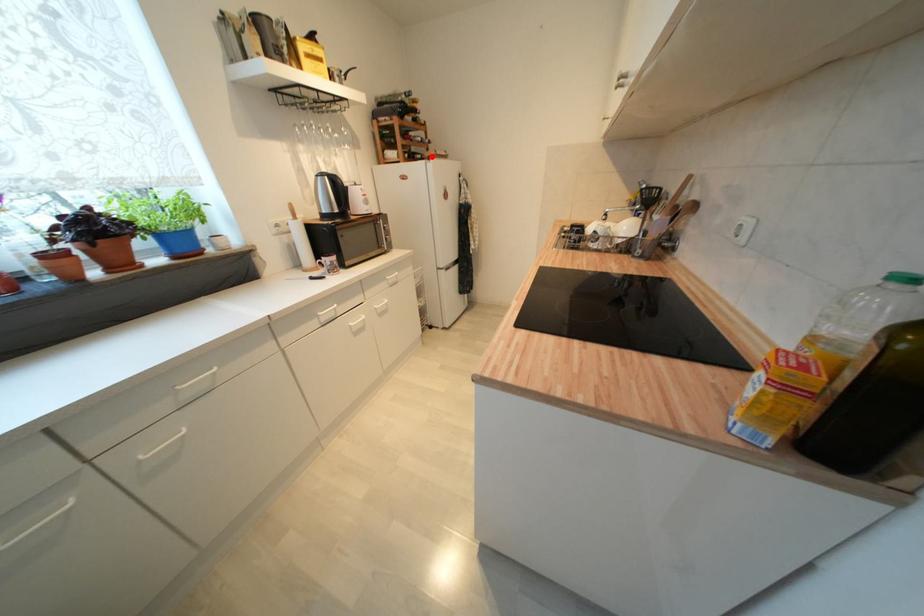
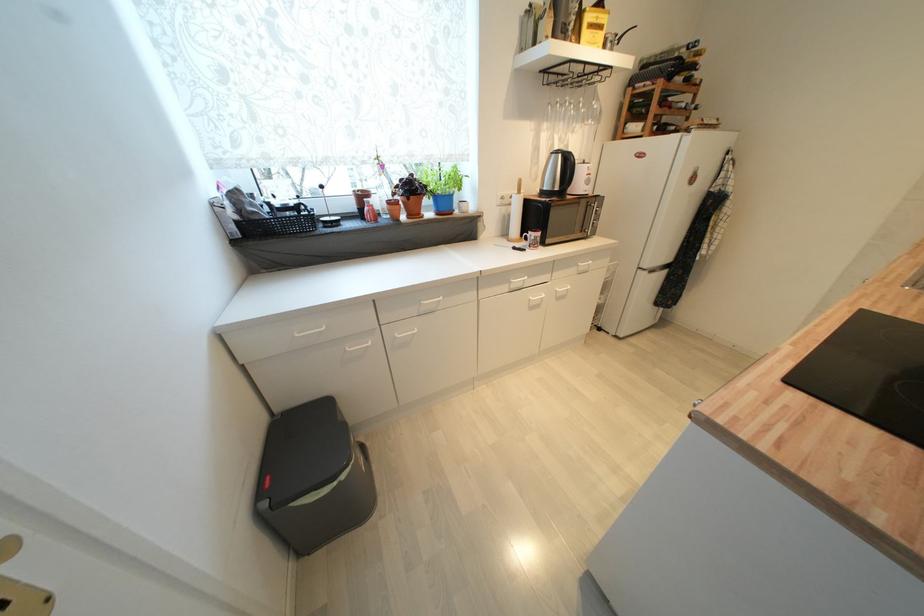
Find the pixel in the second image that matches the highlighted location in the first image.

(690, 127)